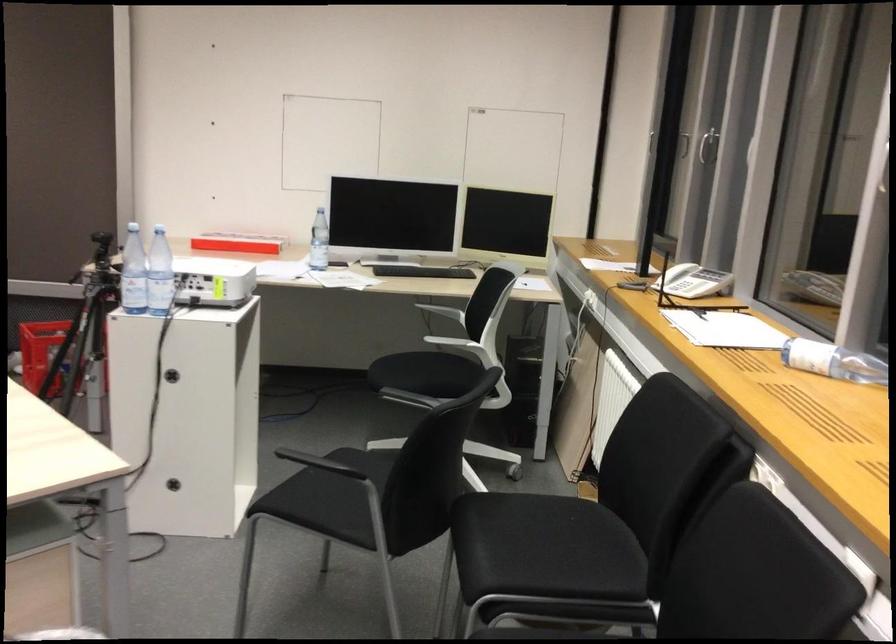
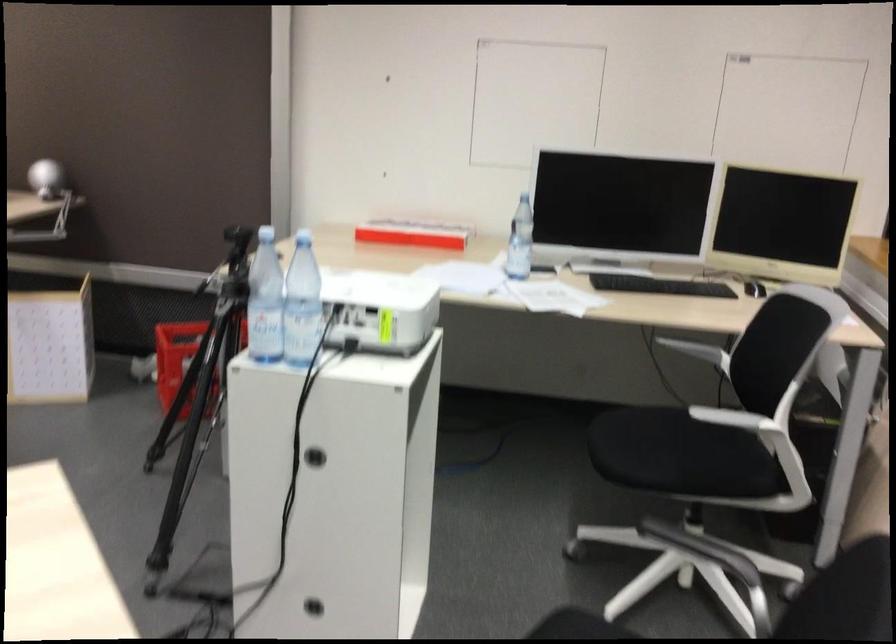
In the second image, find the point that corresponds to point 212,277 in the first image.

(380, 308)